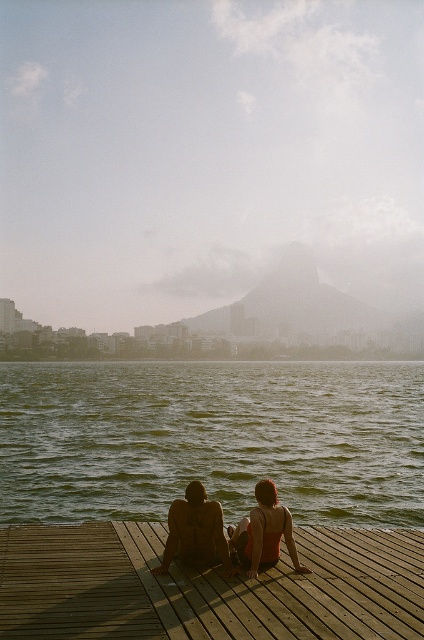
Consider the image. Who is taller, green water at center or wooden at lower center?

With more height is green water at center.

Is green water at center in front of wooden at lower center?

No, it is behind wooden at lower center.

This screenshot has width=424, height=640. What do you see at coordinates (212, 438) in the screenshot?
I see `green water at center` at bounding box center [212, 438].

Where is `green water at center`? Image resolution: width=424 pixels, height=640 pixels. green water at center is located at coordinates (212, 438).

Between green water at center and matte skin couple at center, which one is positioned lower?

green water at center is below.

Does green water at center have a larger size compared to matte skin couple at center?

Indeed, green water at center has a larger size compared to matte skin couple at center.

The height and width of the screenshot is (640, 424). Describe the element at coordinates (212, 438) in the screenshot. I see `green water at center` at that location.

Find the location of a particular element. green water at center is located at coordinates (212, 438).

Is wooden at lower center positioned behind matte skin couple at center?

No, wooden at lower center is closer to the viewer.

Is wooden at lower center to the right of matte skin couple at center from the viewer's perspective?

Incorrect, wooden at lower center is not on the right side of matte skin couple at center.

Does point (119, 547) come closer to viewer compared to point (259, 518)?

No, it is behind (259, 518).

This screenshot has height=640, width=424. What are the coordinates of `wooden at lower center` in the screenshot? It's located at (206, 588).